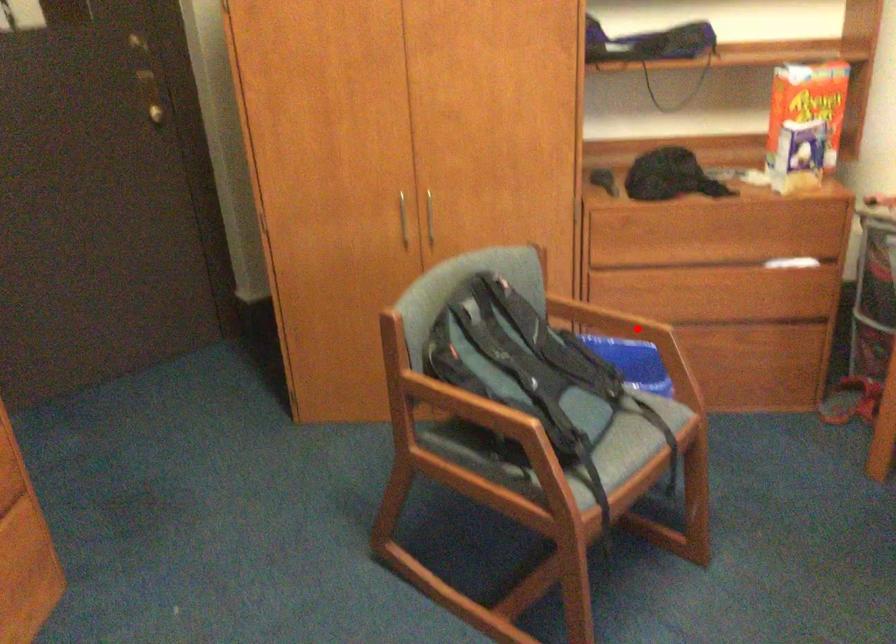
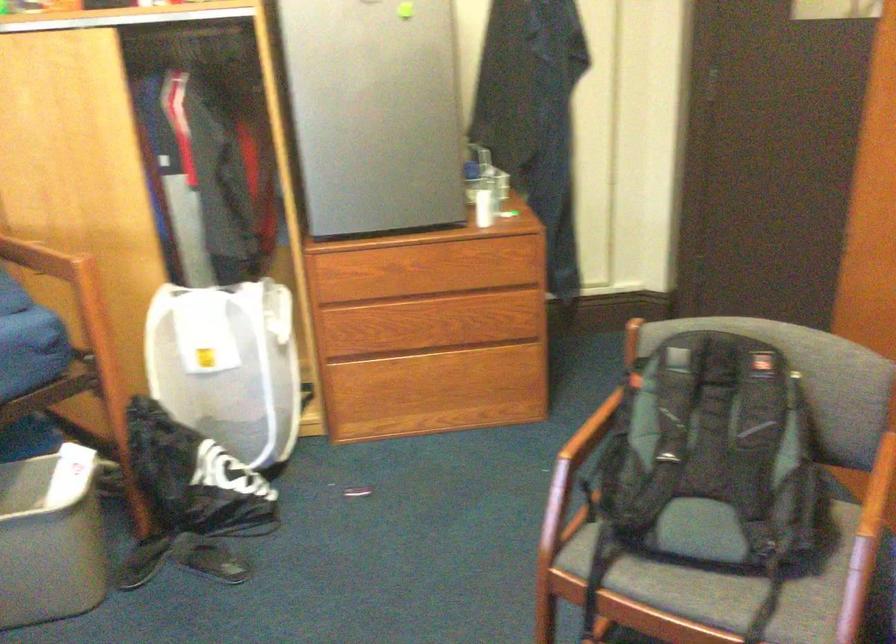
Question: I am providing you with two images of the same scene from different viewpoints. A red point is shown in image1. For the corresponding object point in image2, is it positioned nearer or farther from the camera?

Choices:
 (A) Nearer
 (B) Farther

Answer: (A)